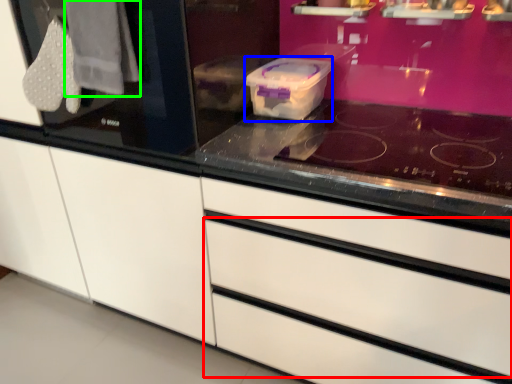
Question: Which object is positioned farthest from drawer (highlighted by a red box)? Select from appliance (highlighted by a blue box) and clothe (highlighted by a green box).

Choices:
 (A) appliance
 (B) clothe

Answer: (B)